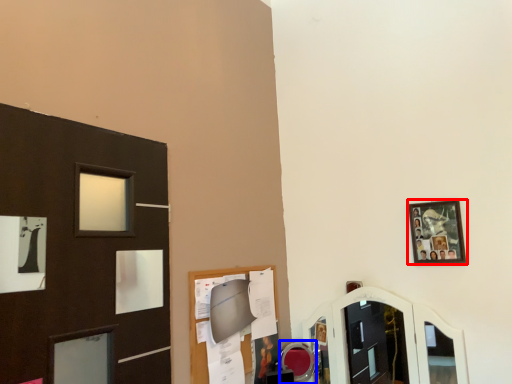
Question: Which object appears farthest to the camera in this image, picture frame (highlighted by a red box) or mirror (highlighted by a blue box)?

Choices:
 (A) picture frame
 (B) mirror

Answer: (B)